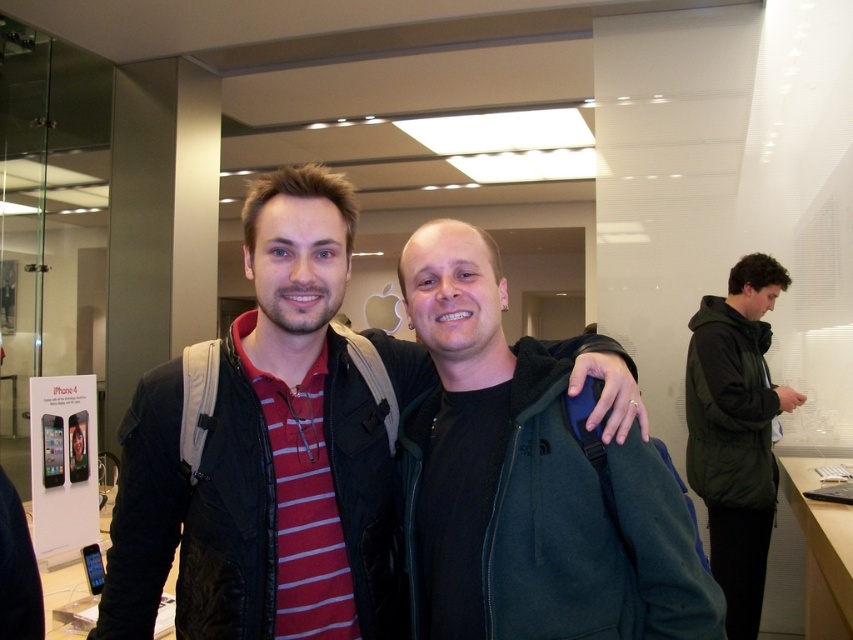
Question: Considering the real-world distances, which object is farthest from the matte black jacket at center?

Choices:
 (A) green fleece jacket at center
 (B) green matte jacket at right

Answer: (B)

Question: Among these points, which one is farthest from the camera?

Choices:
 (A) pyautogui.click(x=322, y=621)
 (B) pyautogui.click(x=701, y=339)
 (C) pyautogui.click(x=488, y=339)

Answer: (B)

Question: Is matte black jacket at center below green matte jacket at right?

Choices:
 (A) yes
 (B) no

Answer: (B)

Question: Can you confirm if green fleece jacket at center is positioned to the left of green matte jacket at right?

Choices:
 (A) yes
 (B) no

Answer: (A)

Question: Estimate the real-world distances between objects in this image. Which object is closer to the matte black jacket at center?

Choices:
 (A) green matte jacket at right
 (B) green fleece jacket at center

Answer: (B)

Question: Is green fleece jacket at center further to the viewer compared to green matte jacket at right?

Choices:
 (A) yes
 (B) no

Answer: (B)